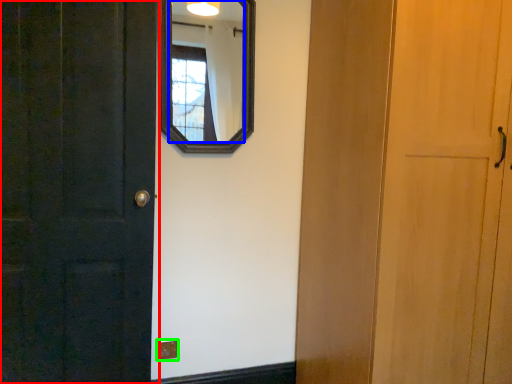
Question: Based on their relative distances, which object is nearer to door (highlighted by a red box)? Choose from mirror (highlighted by a blue box) and electric outlet (highlighted by a green box).

Choices:
 (A) mirror
 (B) electric outlet

Answer: (B)